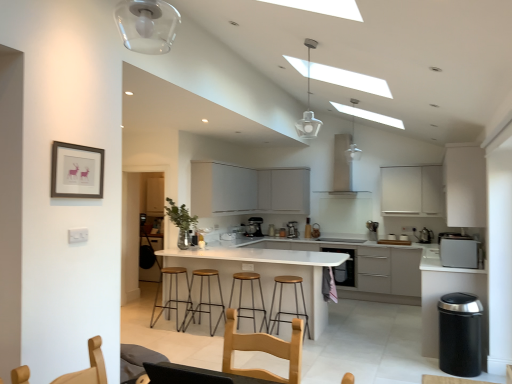
Question: Considering the positions of brown leather bar stool at center, the 4th bar stool from the right, and wooden seat bar stool at center, acting as the third bar stool starting from the right, in the image, is brown leather bar stool at center, the 4th bar stool from the right, wider or thinner than wooden seat bar stool at center, acting as the third bar stool starting from the right,?

Choices:
 (A) thin
 (B) wide

Answer: (B)

Question: From a real-world perspective, relative to wooden seat bar stool at center, acting as the third bar stool starting from the right, is brown leather bar stool at center, arranged as the 1th bar stool when viewed from the left, vertically above or below?

Choices:
 (A) above
 (B) below

Answer: (B)

Question: Which object is positioned farthest from the white glossy table at center?

Choices:
 (A) metallic silver toaster at center, which ranks as the 2th appliance in right-to-left order
 (B) brown leather bar stool at center, the 4th bar stool from the right
 (C) satin silver coffee machine at center, placed as the second coffee machine when sorted from front to back
 (D) satin silver coffee machine at center, positioned as the 3th coffee machine in left-to-right order
 (E) white matte cabinet at upper center, which ranks as the first cabinetry in left-to-right order

Answer: (C)

Question: Which of these objects is positioned closest to the light brown wood swivel chair at lower left, marked as the 2th swivel chair in a right-to-left arrangement?

Choices:
 (A) white matte cabinet at center, positioned as the fourth cabinetry in right-to-left order
 (B) satin silver microwave at right
 (C) satin silver coffee machine at center, which appears as the 2th coffee machine when viewed from the right
 (D) light wood swivel chair at center, the second swivel chair in the left-to-right sequence
 (E) satin silver kettle at right, the 1th appliance in the right-to-left sequence

Answer: (D)